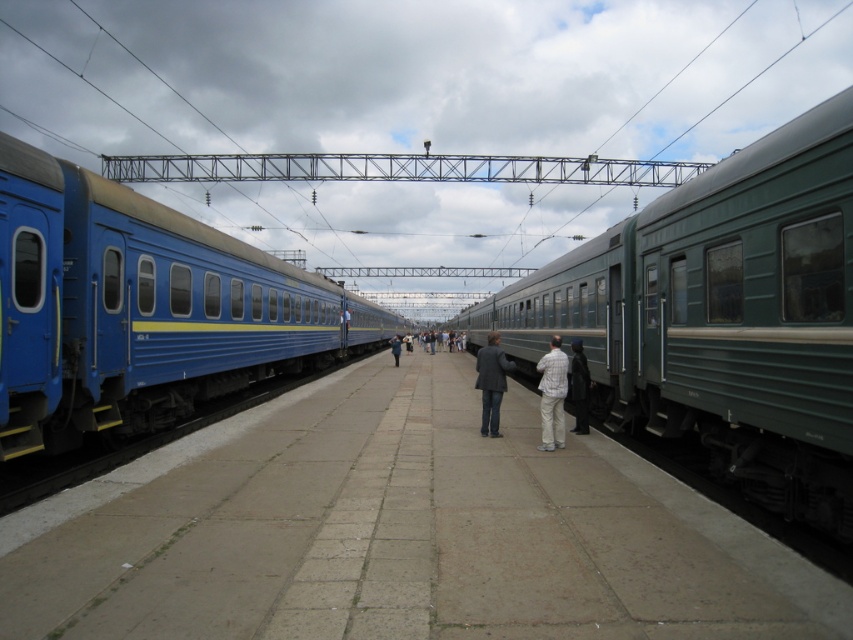
Question: Which of the following is the closest to the observer?

Choices:
 (A) (554, 371)
 (B) (480, 371)

Answer: (A)

Question: Is dark gray coat at center in front of blue fabric jacket at center?

Choices:
 (A) yes
 (B) no

Answer: (A)

Question: Which point is closer to the camera taking this photo?

Choices:
 (A) (91, 298)
 (B) (393, 348)
 (C) (547, 422)
 (D) (486, 368)

Answer: (A)

Question: Which object appears closest to the camera in this image?

Choices:
 (A) blue painted metal train car at left
 (B) concrete platform at center

Answer: (B)

Question: Is green metallic train at right thinner than dark gray jacket at center?

Choices:
 (A) yes
 (B) no

Answer: (B)

Question: Is green metallic train at right wider than dark gray jacket at center?

Choices:
 (A) yes
 (B) no

Answer: (A)